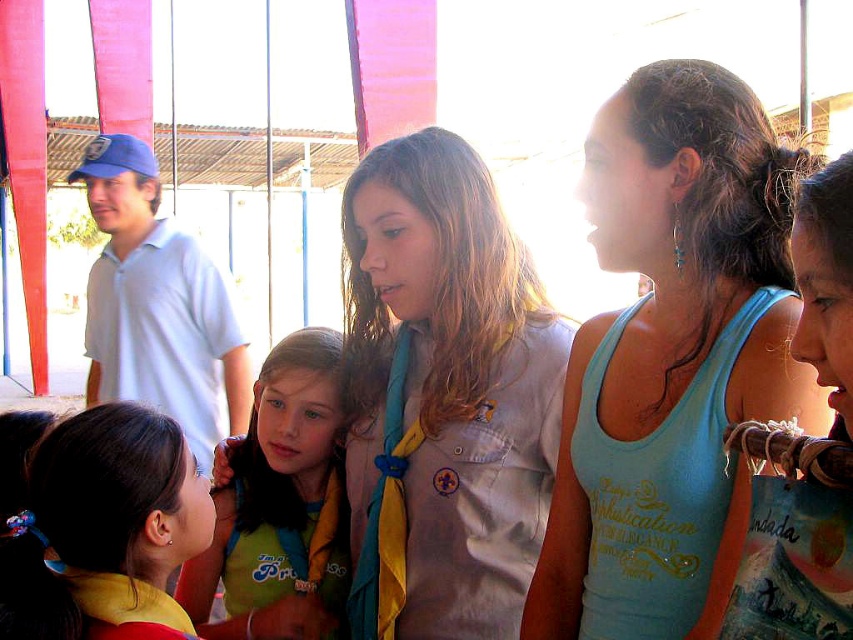
Does blue tank top at center have a greater width compared to light brown fabric uniform at center?

No, blue tank top at center is not wider than light brown fabric uniform at center.

Which of these two, blue tank top at center or light brown fabric uniform at center, stands taller?

Standing taller between the two is light brown fabric uniform at center.

In the scene shown: Measure the distance between point (575, 417) and camera.

Point (575, 417) is 5.39 feet away from camera.

At what (x,y) coordinates should I click in order to perform the action: click on blue tank top at center. Please return your answer as a coordinate pair (x, y). The width and height of the screenshot is (853, 640). Looking at the image, I should click on (672, 358).

Describe the element at coordinates (444, 396) in the screenshot. I see `light brown fabric uniform at center` at that location.

Between point (428, 540) and point (347, 547), which one is positioned behind?

Point (347, 547)

Locate an element on the screen. This screenshot has height=640, width=853. light brown fabric uniform at center is located at coordinates (444, 396).

Consider the image. Which of these two, blue tank top at center or green jersey at center, stands shorter?

green jersey at center

Measure the distance from blue tank top at center to green jersey at center.

blue tank top at center and green jersey at center are 80.56 centimeters apart from each other.

Is point (634, 237) in front of point (273, 380)?

That is True.

The height and width of the screenshot is (640, 853). I want to click on blue tank top at center, so click(x=672, y=358).